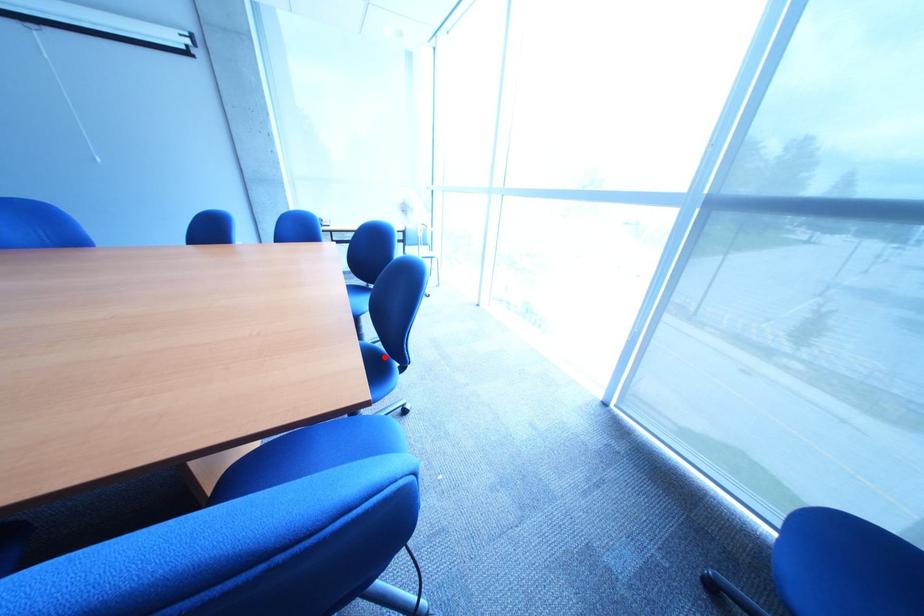
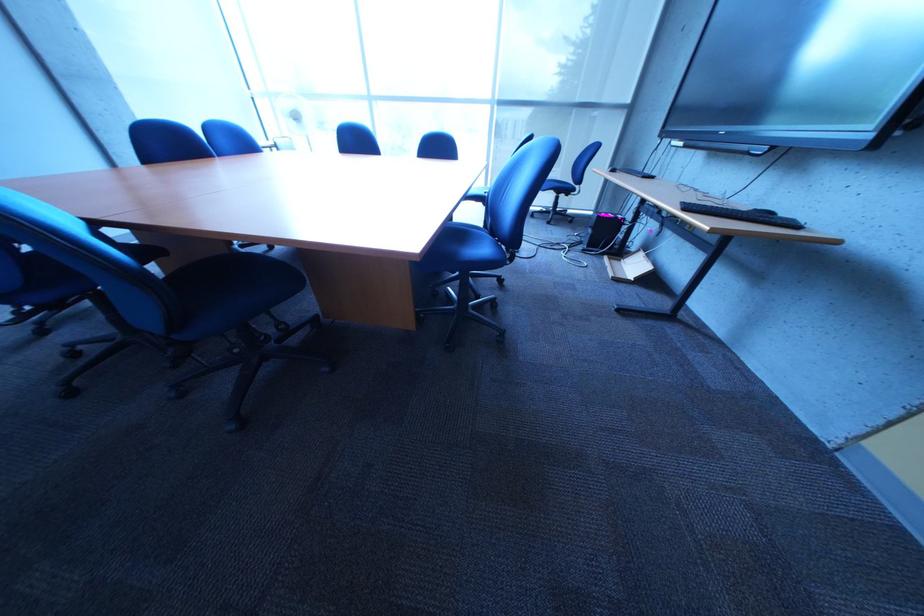
Question: I am providing you with two images of the same scene from different viewpoints. A red point is marked on the first image. Can you still see the location of the red point in image 2?

Choices:
 (A) Yes
 (B) No

Answer: (B)